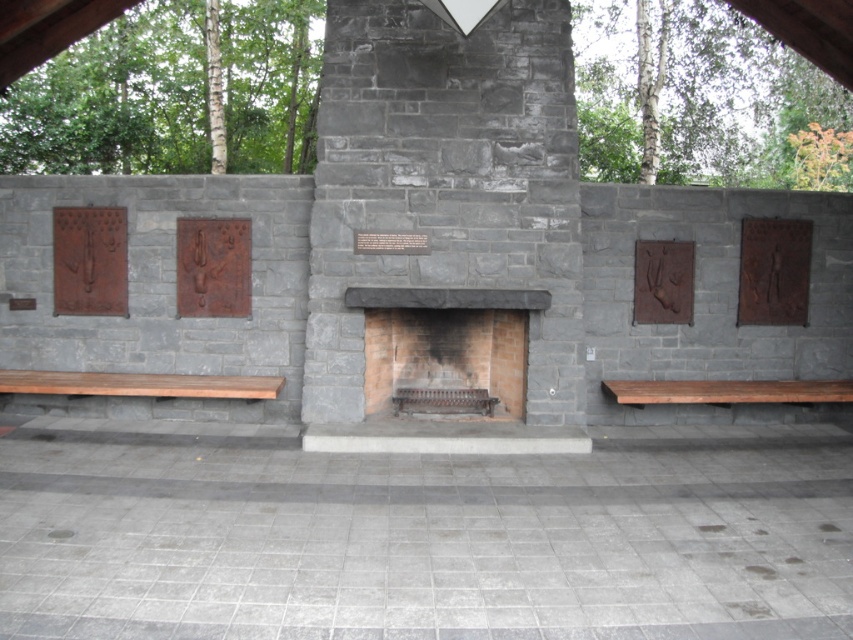
Between rusty metal plaque at left and rustic stone relief at right, which one is positioned higher?

rusty metal plaque at left is higher up.

Describe the element at coordinates (90, 260) in the screenshot. I see `rusty metal plaque at left` at that location.

Measure the distance between rusty metal plaque at left and camera.

rusty metal plaque at left is 7.07 meters away from camera.

Where is `rusty metal plaque at left`? The image size is (853, 640). rusty metal plaque at left is located at coordinates (90, 260).

Is dark gray stone fireplace at center positioned in front of rusty metal plaque at right?

Yes, dark gray stone fireplace at center is in front of rusty metal plaque at right.

Is dark gray stone fireplace at center taller than rusty metal plaque at right?

Indeed, dark gray stone fireplace at center has a greater height compared to rusty metal plaque at right.

Between point (309, 342) and point (755, 285), which one is positioned behind?

The point (755, 285) is more distant.

Locate an element on the screen. dark gray stone fireplace at center is located at coordinates (445, 211).

Can you confirm if brick fireplace at center is positioned below brown stone plaque at center?

Indeed, brick fireplace at center is positioned under brown stone plaque at center.

Is brick fireplace at center positioned behind brown stone plaque at center?

No, it is in front of brown stone plaque at center.

Who is more forward, [489,296] or [367,253]?

Positioned in front is point [489,296].

The image size is (853, 640). What are the coordinates of `brick fireplace at center` in the screenshot? It's located at (445, 348).